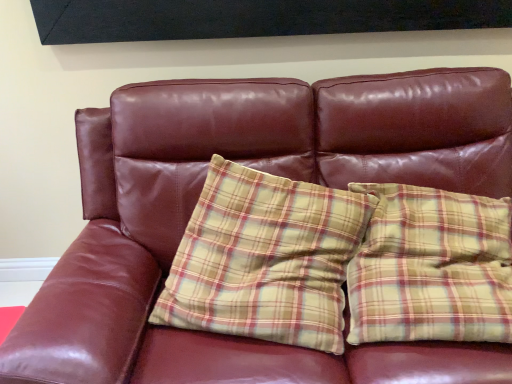
Question: Is yellow plaid pillow at center, placed as the 1th pillow when sorted from left to right, thinner than yellow plaid pillow at right, positioned as the 1th pillow in right-to-left order?

Choices:
 (A) no
 (B) yes

Answer: (A)

Question: Is yellow plaid pillow at right, which is the second pillow in left-to-right order, located within yellow plaid pillow at center, acting as the second pillow starting from the right?

Choices:
 (A) no
 (B) yes

Answer: (A)

Question: Is yellow plaid pillow at center, placed as the 1th pillow when sorted from left to right, taller than yellow plaid pillow at right, positioned as the 1th pillow in right-to-left order?

Choices:
 (A) no
 (B) yes

Answer: (B)

Question: Can you confirm if yellow plaid pillow at center, placed as the 1th pillow when sorted from left to right, is wider than yellow plaid pillow at right, which is the second pillow in left-to-right order?

Choices:
 (A) yes
 (B) no

Answer: (A)

Question: From the image's perspective, is yellow plaid pillow at center, placed as the 1th pillow when sorted from left to right, over yellow plaid pillow at right, which is the second pillow in left-to-right order?

Choices:
 (A) yes
 (B) no

Answer: (B)

Question: Can you confirm if yellow plaid pillow at center, placed as the 1th pillow when sorted from left to right, is bigger than yellow plaid pillow at right, which is the second pillow in left-to-right order?

Choices:
 (A) no
 (B) yes

Answer: (B)

Question: Does yellow plaid pillow at right, positioned as the 1th pillow in right-to-left order, come behind yellow plaid pillow at center, acting as the second pillow starting from the right?

Choices:
 (A) yes
 (B) no

Answer: (B)

Question: Considering the relative positions of yellow plaid pillow at right, which is the second pillow in left-to-right order, and yellow plaid pillow at center, placed as the 1th pillow when sorted from left to right, in the image provided, is yellow plaid pillow at right, which is the second pillow in left-to-right order, to the left of yellow plaid pillow at center, placed as the 1th pillow when sorted from left to right, from the viewer's perspective?

Choices:
 (A) no
 (B) yes

Answer: (A)

Question: Is yellow plaid pillow at right, which is the second pillow in left-to-right order, aimed at yellow plaid pillow at center, acting as the second pillow starting from the right?

Choices:
 (A) no
 (B) yes

Answer: (A)

Question: Is yellow plaid pillow at right, positioned as the 1th pillow in right-to-left order, positioned with its back to yellow plaid pillow at center, placed as the 1th pillow when sorted from left to right?

Choices:
 (A) yes
 (B) no

Answer: (B)

Question: From a real-world perspective, does yellow plaid pillow at right, which is the second pillow in left-to-right order, stand above yellow plaid pillow at center, placed as the 1th pillow when sorted from left to right?

Choices:
 (A) no
 (B) yes

Answer: (B)

Question: Is there a large distance between yellow plaid pillow at right, which is the second pillow in left-to-right order, and yellow plaid pillow at center, acting as the second pillow starting from the right?

Choices:
 (A) no
 (B) yes

Answer: (A)

Question: Is yellow plaid pillow at center, placed as the 1th pillow when sorted from left to right, situated inside yellow plaid pillow at right, which is the second pillow in left-to-right order, or outside?

Choices:
 (A) inside
 (B) outside

Answer: (B)